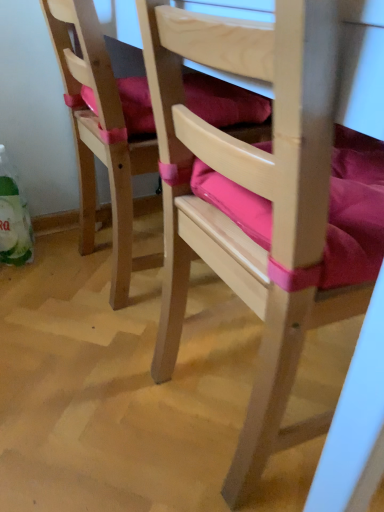
This screenshot has height=512, width=384. What are the coordinates of `pink fabric cushion at left, which is the 1th chair in left-to-right order` in the screenshot? It's located at (101, 133).

The width and height of the screenshot is (384, 512). Describe the element at coordinates (101, 133) in the screenshot. I see `pink fabric cushion at left, which is the 1th chair in left-to-right order` at that location.

Image resolution: width=384 pixels, height=512 pixels. Describe the element at coordinates (252, 191) in the screenshot. I see `wooden chair with pink cushion at center, the second chair in the left-to-right sequence` at that location.

Where is `wooden chair with pink cushion at center, the second chair in the left-to-right sequence`? The height and width of the screenshot is (512, 384). wooden chair with pink cushion at center, the second chair in the left-to-right sequence is located at coordinates (252, 191).

How much space does wooden chair with pink cushion at center, the second chair in the left-to-right sequence, occupy vertically?

The height of wooden chair with pink cushion at center, the second chair in the left-to-right sequence, is 29.40 inches.

The height and width of the screenshot is (512, 384). I want to click on pink fabric cushion at left, which is the 1th chair in left-to-right order, so click(101, 133).

Does wooden chair with pink cushion at center, arranged as the 1th chair when viewed from the right, appear on the left side of pink fabric cushion at left, which ranks as the second chair in right-to-left order?

No.

Which is behind, wooden chair with pink cushion at center, arranged as the 1th chair when viewed from the right, or pink fabric cushion at left, which ranks as the second chair in right-to-left order?

pink fabric cushion at left, which ranks as the second chair in right-to-left order, is behind.

Is point (331, 106) positioned after point (72, 71)?

No, (331, 106) is closer to viewer.

From the image's perspective, is wooden chair with pink cushion at center, the second chair in the left-to-right sequence, positioned above or below pink fabric cushion at left, which ranks as the second chair in right-to-left order?

Based on their image positions, wooden chair with pink cushion at center, the second chair in the left-to-right sequence, is located beneath pink fabric cushion at left, which ranks as the second chair in right-to-left order.

From a real-world perspective, is wooden chair with pink cushion at center, the second chair in the left-to-right sequence, positioned above or below pink fabric cushion at left, which is the 1th chair in left-to-right order?

wooden chair with pink cushion at center, the second chair in the left-to-right sequence, is above pink fabric cushion at left, which is the 1th chair in left-to-right order.

Is wooden chair with pink cushion at center, the second chair in the left-to-right sequence, wider than pink fabric cushion at left, which ranks as the second chair in right-to-left order?

Indeed, wooden chair with pink cushion at center, the second chair in the left-to-right sequence, has a greater width compared to pink fabric cushion at left, which ranks as the second chair in right-to-left order.

Who is taller, wooden chair with pink cushion at center, the second chair in the left-to-right sequence, or pink fabric cushion at left, which ranks as the second chair in right-to-left order?

wooden chair with pink cushion at center, the second chair in the left-to-right sequence.

Can you confirm if wooden chair with pink cushion at center, arranged as the 1th chair when viewed from the right, is smaller than pink fabric cushion at left, which ranks as the second chair in right-to-left order?

No, wooden chair with pink cushion at center, arranged as the 1th chair when viewed from the right, is not smaller than pink fabric cushion at left, which ranks as the second chair in right-to-left order.

Is wooden chair with pink cushion at center, the second chair in the left-to-right sequence, positioned beyond the bounds of pink fabric cushion at left, which ranks as the second chair in right-to-left order?

Indeed, wooden chair with pink cushion at center, the second chair in the left-to-right sequence, is completely outside pink fabric cushion at left, which ranks as the second chair in right-to-left order.

Are wooden chair with pink cushion at center, arranged as the 1th chair when viewed from the right, and pink fabric cushion at left, which ranks as the second chair in right-to-left order, beside each other?

No, wooden chair with pink cushion at center, arranged as the 1th chair when viewed from the right, is not with pink fabric cushion at left, which ranks as the second chair in right-to-left order.

Looking at this image, is wooden chair with pink cushion at center, the second chair in the left-to-right sequence, looking in the opposite direction of pink fabric cushion at left, which ranks as the second chair in right-to-left order?

wooden chair with pink cushion at center, the second chair in the left-to-right sequence, does not have its back to pink fabric cushion at left, which ranks as the second chair in right-to-left order.

Identify the location of chair located on the left of wooden chair with pink cushion at center, arranged as the 1th chair when viewed from the right. (101, 133).

Looking at this image, is pink fabric cushion at left, which ranks as the second chair in right-to-left order, to the right of wooden chair with pink cushion at center, the second chair in the left-to-right sequence, from the viewer's perspective?

In fact, pink fabric cushion at left, which ranks as the second chair in right-to-left order, is to the left of wooden chair with pink cushion at center, the second chair in the left-to-right sequence.

Considering the relative positions of pink fabric cushion at left, which ranks as the second chair in right-to-left order, and wooden chair with pink cushion at center, the second chair in the left-to-right sequence, in the image provided, is pink fabric cushion at left, which ranks as the second chair in right-to-left order, in front of wooden chair with pink cushion at center, the second chair in the left-to-right sequence,?

No, pink fabric cushion at left, which ranks as the second chair in right-to-left order, is behind wooden chair with pink cushion at center, the second chair in the left-to-right sequence.

Does point (127, 240) lie behind point (287, 326)?

That is True.

From the image's perspective, is pink fabric cushion at left, which ranks as the second chair in right-to-left order, under wooden chair with pink cushion at center, arranged as the 1th chair when viewed from the right?

No, from the image's perspective, pink fabric cushion at left, which ranks as the second chair in right-to-left order, is not beneath wooden chair with pink cushion at center, arranged as the 1th chair when viewed from the right.

From a real-world perspective, relative to wooden chair with pink cushion at center, the second chair in the left-to-right sequence, is pink fabric cushion at left, which ranks as the second chair in right-to-left order, vertically above or below?

pink fabric cushion at left, which ranks as the second chair in right-to-left order, is situated lower than wooden chair with pink cushion at center, the second chair in the left-to-right sequence, in the real world.

Based on the photo, can you confirm if pink fabric cushion at left, which is the 1th chair in left-to-right order, is thinner than wooden chair with pink cushion at center, the second chair in the left-to-right sequence?

Correct, the width of pink fabric cushion at left, which is the 1th chair in left-to-right order, is less than that of wooden chair with pink cushion at center, the second chair in the left-to-right sequence.

Is pink fabric cushion at left, which is the 1th chair in left-to-right order, shorter than wooden chair with pink cushion at center, the second chair in the left-to-right sequence?

Yes.

Which of these two, pink fabric cushion at left, which is the 1th chair in left-to-right order, or wooden chair with pink cushion at center, the second chair in the left-to-right sequence, is bigger?

wooden chair with pink cushion at center, the second chair in the left-to-right sequence.

Could wooden chair with pink cushion at center, the second chair in the left-to-right sequence, be considered to be inside pink fabric cushion at left, which ranks as the second chair in right-to-left order?

No, wooden chair with pink cushion at center, the second chair in the left-to-right sequence, is not a part of pink fabric cushion at left, which ranks as the second chair in right-to-left order.

Are pink fabric cushion at left, which ranks as the second chair in right-to-left order, and wooden chair with pink cushion at center, arranged as the 1th chair when viewed from the right, beside each other?

pink fabric cushion at left, which ranks as the second chair in right-to-left order, is not next to wooden chair with pink cushion at center, arranged as the 1th chair when viewed from the right, and they're not touching.

Is pink fabric cushion at left, which ranks as the second chair in right-to-left order, aimed at wooden chair with pink cushion at center, the second chair in the left-to-right sequence?

No, pink fabric cushion at left, which ranks as the second chair in right-to-left order, does not turn towards wooden chair with pink cushion at center, the second chair in the left-to-right sequence.

How distant is pink fabric cushion at left, which is the 1th chair in left-to-right order, from wooden chair with pink cushion at center, arranged as the 1th chair when viewed from the right?

A distance of 16.04 inches exists between pink fabric cushion at left, which is the 1th chair in left-to-right order, and wooden chair with pink cushion at center, arranged as the 1th chair when viewed from the right.

The width and height of the screenshot is (384, 512). Identify the location of chair lying on the left of wooden chair with pink cushion at center, the second chair in the left-to-right sequence. (101, 133).

Find the location of a particular element. This screenshot has width=384, height=512. chair beneath the wooden chair with pink cushion at center, arranged as the 1th chair when viewed from the right (from a real-world perspective) is located at coordinates pos(101,133).

The width and height of the screenshot is (384, 512). Identify the location of chair behind the wooden chair with pink cushion at center, the second chair in the left-to-right sequence. (101, 133).